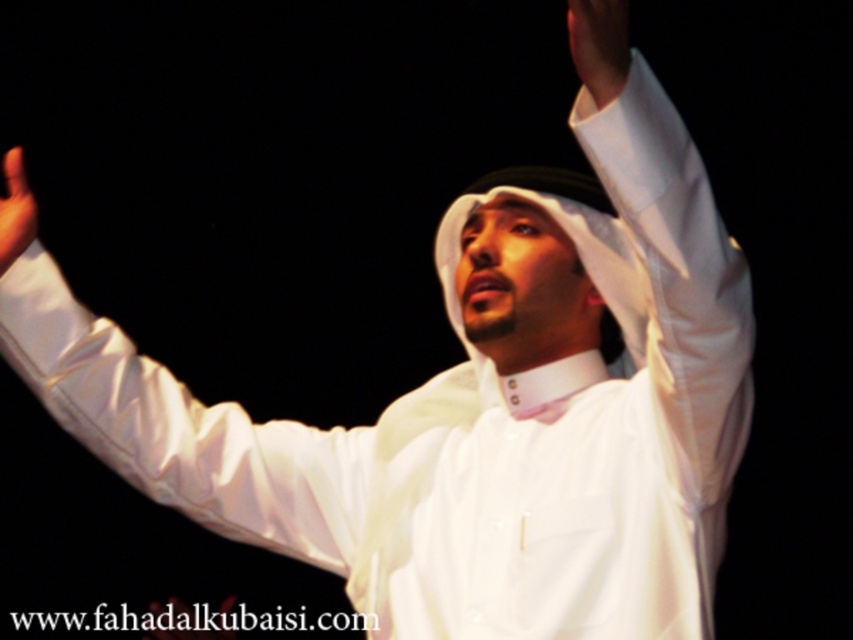
Question: Considering the real-world distances, which object is farthest from the white smooth hand at upper center?

Choices:
 (A) white matte hand at upper left
 (B) white satin shirt at upper center
 (C) white satin arm at upper left

Answer: (C)

Question: Does white satin arm at upper left have a smaller size compared to white satin shirt at upper center?

Choices:
 (A) yes
 (B) no

Answer: (B)

Question: Among these points, which one is nearest to the camera?

Choices:
 (A) (677, 120)
 (B) (10, 225)
 (C) (593, 28)
 (D) (183, 428)

Answer: (C)

Question: Is white satin arm at upper left below white satin shirt at upper center?

Choices:
 (A) no
 (B) yes

Answer: (B)

Question: Which object appears closest to the camera in this image?

Choices:
 (A) white satin shirt at upper center
 (B) white satin arm at upper left
 (C) white matte hand at upper left

Answer: (A)

Question: Can you confirm if white satin arm at upper left is positioned above white matte hand at upper left?

Choices:
 (A) no
 (B) yes

Answer: (A)